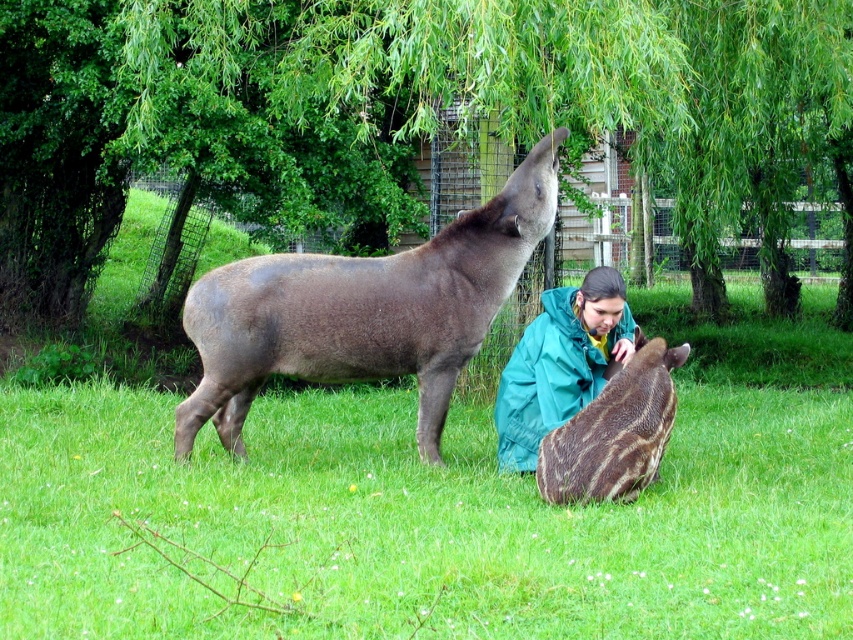
Does green leafy tree at upper center appear on the right side of brown matte tapir at center?

Yes, green leafy tree at upper center is to the right of brown matte tapir at center.

The width and height of the screenshot is (853, 640). Identify the location of green leafy tree at upper center. (396, 109).

Where is `green leafy tree at upper center`? This screenshot has height=640, width=853. green leafy tree at upper center is located at coordinates (396, 109).

Does teal fabric jacket at center have a greater height compared to brown textured pig at lower center?

Yes.

Can you confirm if teal fabric jacket at center is positioned below brown textured pig at lower center?

Actually, teal fabric jacket at center is above brown textured pig at lower center.

Is point (573, 355) less distant than point (630, 467)?

No, (573, 355) is further to viewer.

The image size is (853, 640). Identify the location of teal fabric jacket at center. (560, 364).

Which is in front, point (393, 557) or point (610, 436)?

Positioned in front is point (393, 557).

Identify the location of green grass at center. (421, 522).